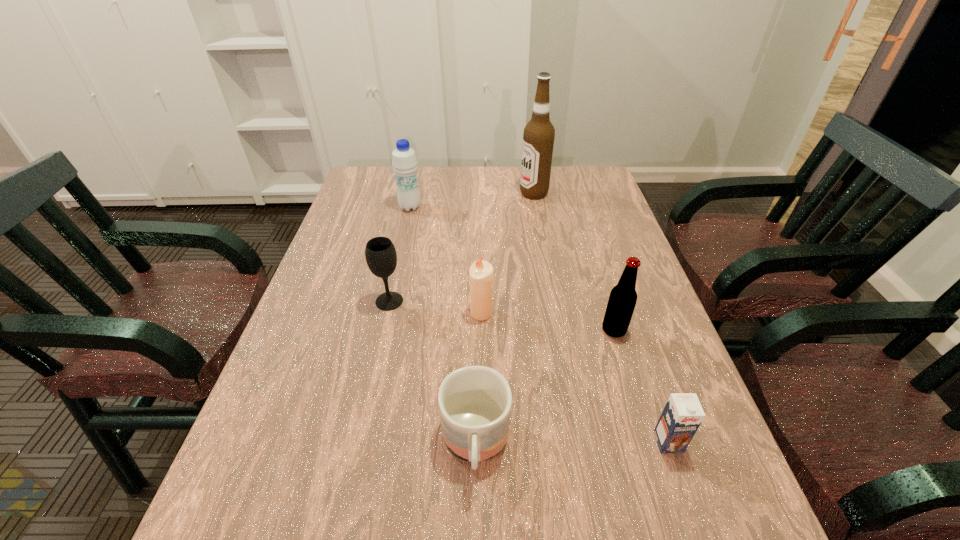
Locate an element on the screen. Image resolution: width=960 pixels, height=540 pixels. alcohol is located at coordinates [x=538, y=138].

Locate an element on the screen. The width and height of the screenshot is (960, 540). the tallest object is located at coordinates (538, 138).

Identify the location of water bottle. This screenshot has height=540, width=960. (404, 161).

Identify the location of beer bottle. This screenshot has height=540, width=960. (622, 300).

Locate an element on the screen. The image size is (960, 540). wineglass is located at coordinates (381, 257).

Locate an element on the screen. candle is located at coordinates (481, 275).

The image size is (960, 540). Find the location of `chocolate milk`. chocolate milk is located at coordinates (682, 415).

Find the location of a particular element. The height and width of the screenshot is (540, 960). mug is located at coordinates (475, 402).

This screenshot has width=960, height=540. In order to click on vacant area situated 0.160m on the label of the tallest object in this screenshot , I will do `click(471, 193)`.

Image resolution: width=960 pixels, height=540 pixels. I want to click on vacant space located 0.370m on the label of the tallest object, so click(x=409, y=193).